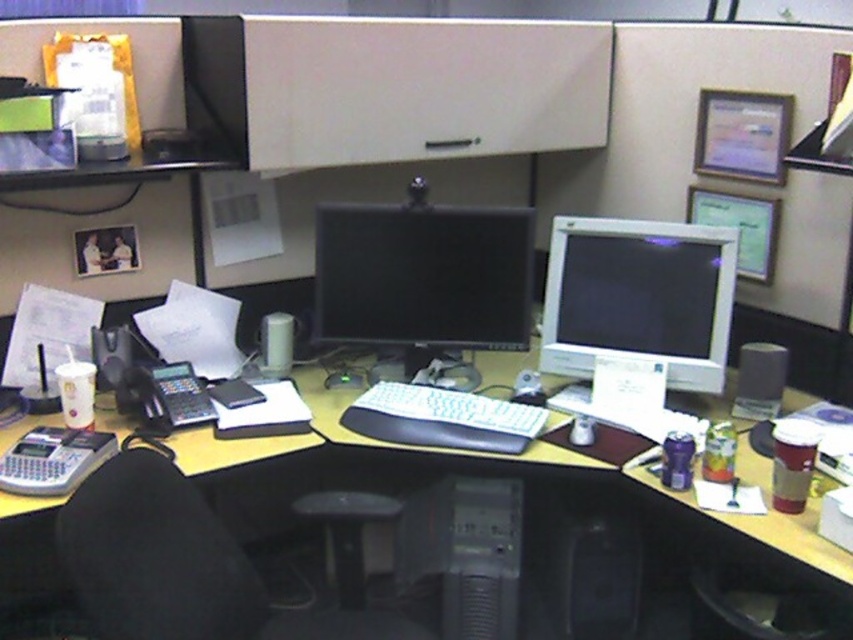
Question: Which point is closer to the camera?

Choices:
 (A) (653, 324)
 (B) (100, 550)
 (C) (500, 346)
 (D) (505, 604)

Answer: (B)

Question: Does white glossy monitor at center have a larger size compared to black plastic mouse at center?

Choices:
 (A) no
 (B) yes

Answer: (B)

Question: Considering the real-world distances, which object is farthest from the black glossy monitor at center?

Choices:
 (A) black fabric swivel chair at center
 (B) white plastic computer desk at center
 (C) black plastic computer tower at center

Answer: (A)

Question: Can you confirm if black fabric swivel chair at center is positioned above black plastic mouse at center?

Choices:
 (A) yes
 (B) no

Answer: (B)

Question: Does white plastic computer desk at center have a larger size compared to white glossy monitor at center?

Choices:
 (A) yes
 (B) no

Answer: (A)

Question: Which point is farther to the camera?

Choices:
 (A) black plastic mouse at center
 (B) white glossy monitor at center
 (C) black glossy monitor at center
 (D) black fabric swivel chair at center

Answer: (C)